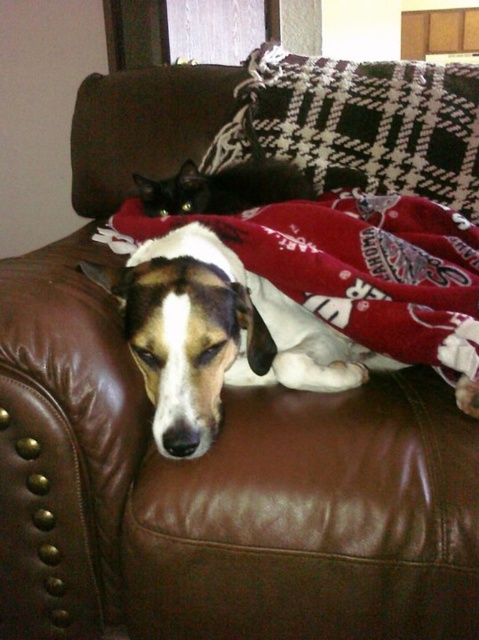
Consider the image. You are trying to decide whether to place a new throw pillow on the couch. The couch currently has a red fleece blanket at center and a plaid fabric pillow at upper center. Which object has a greater width?

The red fleece blanket at center has a greater width than the plaid fabric pillow at upper center.

You are trying to decide whether to place a new throw pillow on the couch. The red fleece blanket at center and the plaid fabric pillow at upper center are already there. Which object is shorter so that the new pillow can be placed next to it?

The red fleece blanket at center is shorter than the plaid fabric pillow at upper center, so the new throw pillow can be placed next to the red fleece blanket at center.